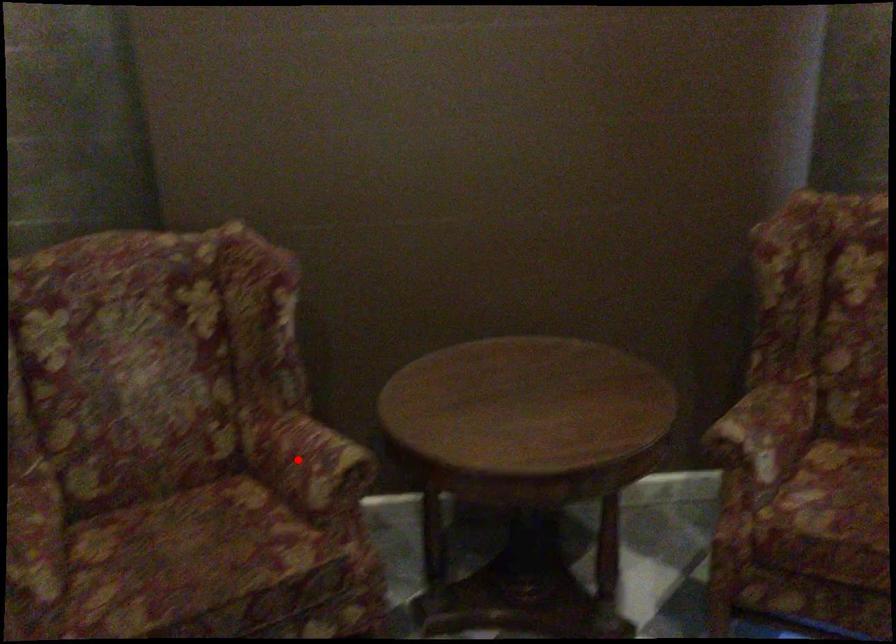
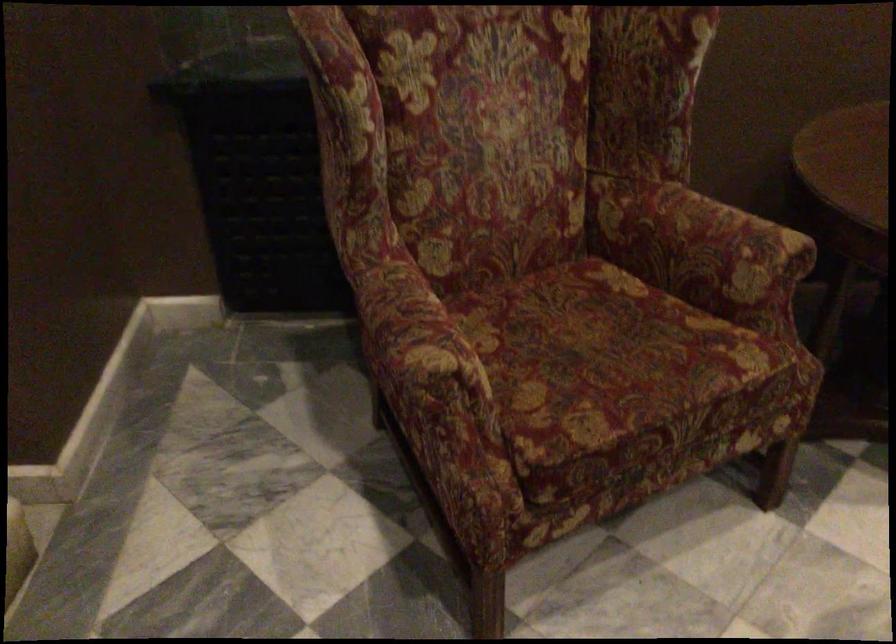
The point at the highlighted location is marked in the first image. Where is the corresponding point in the second image?

(700, 243)